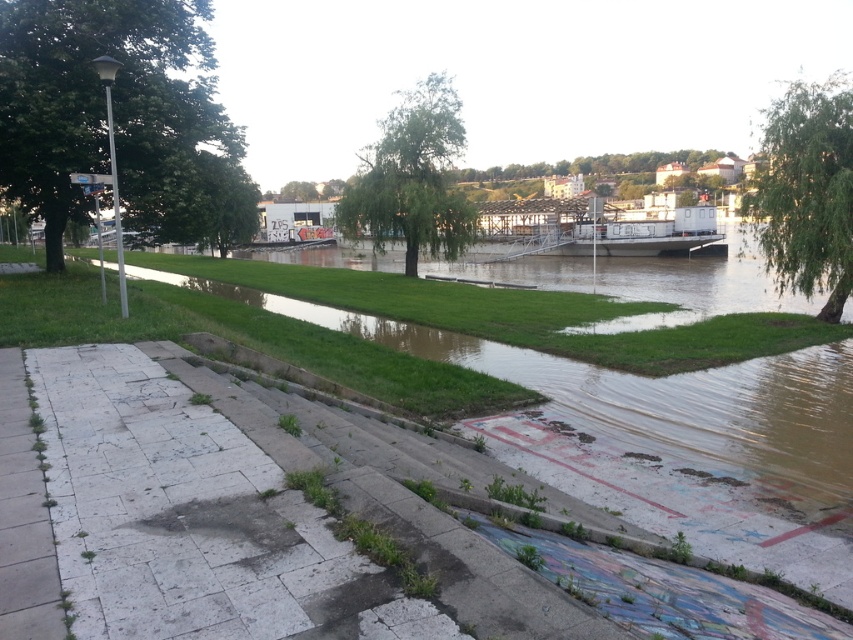
Question: Among these objects, which one is farthest from the camera?

Choices:
 (A) green leafy tree at upper right
 (B) green leafy tree at center
 (C) green leafy tree at left
 (D) gray concrete pavement at lower left

Answer: (B)

Question: From the image, what is the correct spatial relationship of gray concrete steps at lower left in relation to green leafy tree at upper center?

Choices:
 (A) below
 (B) above

Answer: (A)

Question: Which of the following is the closest to the observer?

Choices:
 (A) (844, 241)
 (B) (56, 592)
 (C) (366, 150)

Answer: (B)

Question: Does gray concrete steps at lower left appear on the left side of white matte boat at center?

Choices:
 (A) yes
 (B) no

Answer: (A)

Question: Which of the following is the farthest from the observer?

Choices:
 (A) (289, 496)
 (B) (74, 132)
 (C) (769, 243)
 (D) (480, 172)

Answer: (D)

Question: Is the position of gray concrete steps at lower left more distant than that of green leafy tree at left?

Choices:
 (A) yes
 (B) no

Answer: (B)